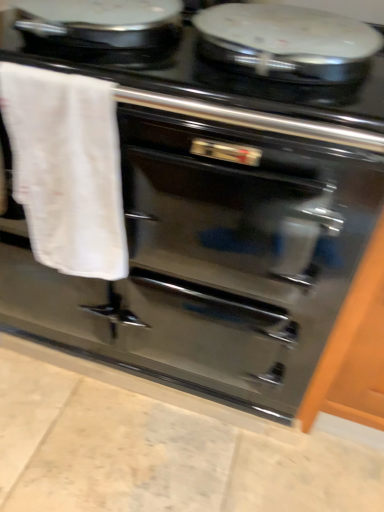
Question: From a real-world perspective, is glossy wood cabinet at right above or below white cotton towel at left?

Choices:
 (A) above
 (B) below

Answer: (B)

Question: In terms of height, does glossy wood cabinet at right look taller or shorter compared to white cotton towel at left?

Choices:
 (A) tall
 (B) short

Answer: (A)

Question: Estimate the real-world distances between objects in this image. Which object is closer to the black glossy stove at upper center?

Choices:
 (A) white cotton towel at left
 (B) glossy wood cabinet at right

Answer: (A)

Question: Which object is the closest to the glossy wood cabinet at right?

Choices:
 (A) white cotton towel at left
 (B) black glossy stove at upper center

Answer: (B)